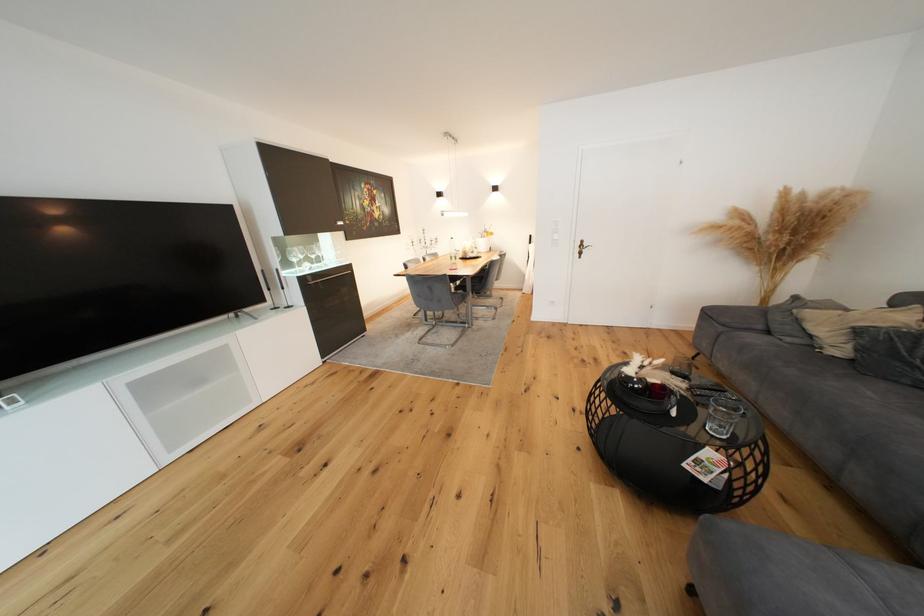
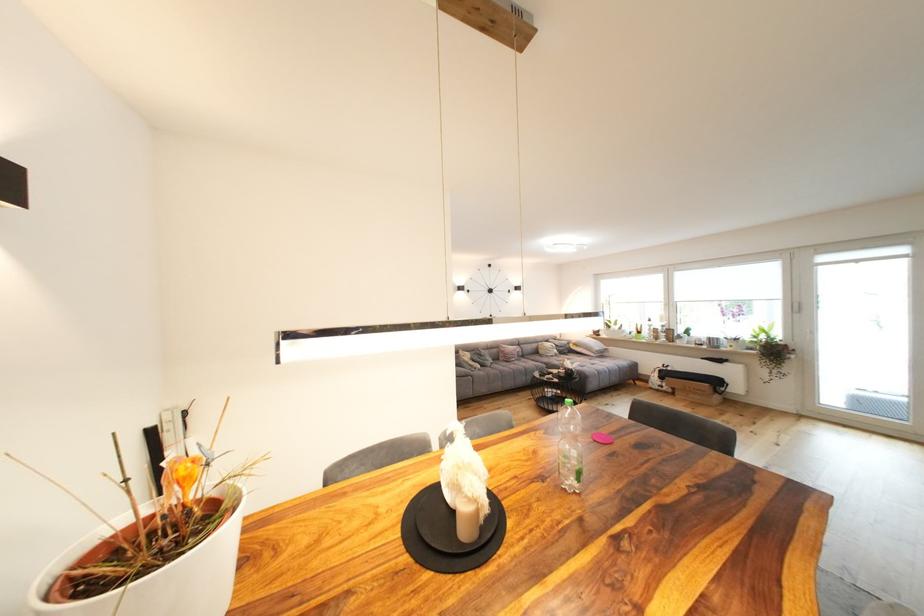
Locate, in the second image, the point that corresponds to (x=845, y=353) in the first image.

(485, 368)